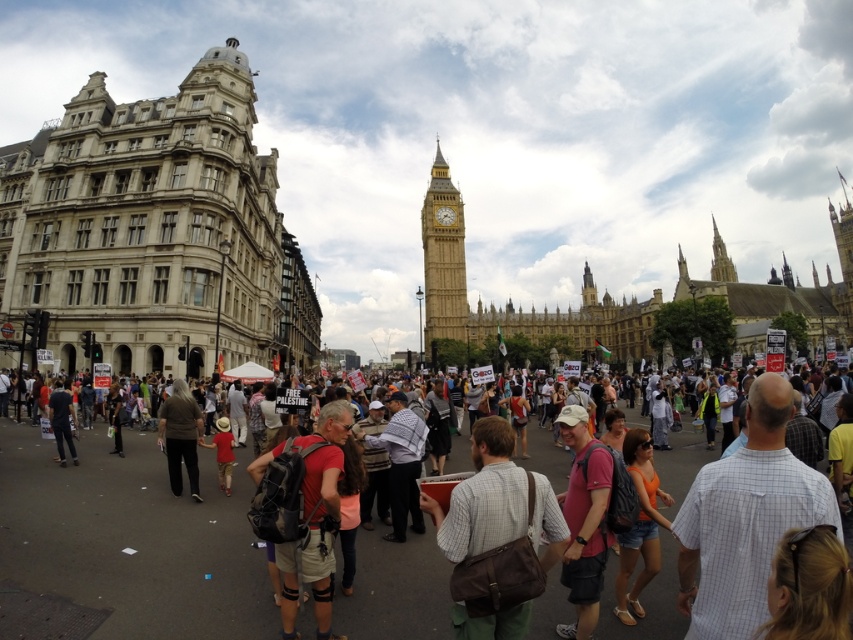
You are a photographer standing in the city square and want to take a photo of the brown leather bag at center. Which direction should you move to get a better shot?

The brown leather bag at center is located at point (496, 502), so you should move towards the center of the square to get a better shot.

You are a photographer at the protest and want to capture a photo of the pink fabric shirt at center and dark blue jeans at center. Which one should you focus on first if you want to include both in the frame?

The pink fabric shirt at center is positioned on the right side of dark blue jeans at center, so you should focus on the dark blue jeans at center first to ensure both are in frame.

You are a photographer standing in the crowd at the protest. You have a matte black backpack at center and brown fabric pants at center in your viewfinder. Which object should you zoom in on if you want to capture the larger item in your photo?

The matte black backpack at center is larger in size than the brown fabric pants at center, so you should zoom in on the matte black backpack at center to capture the larger item.